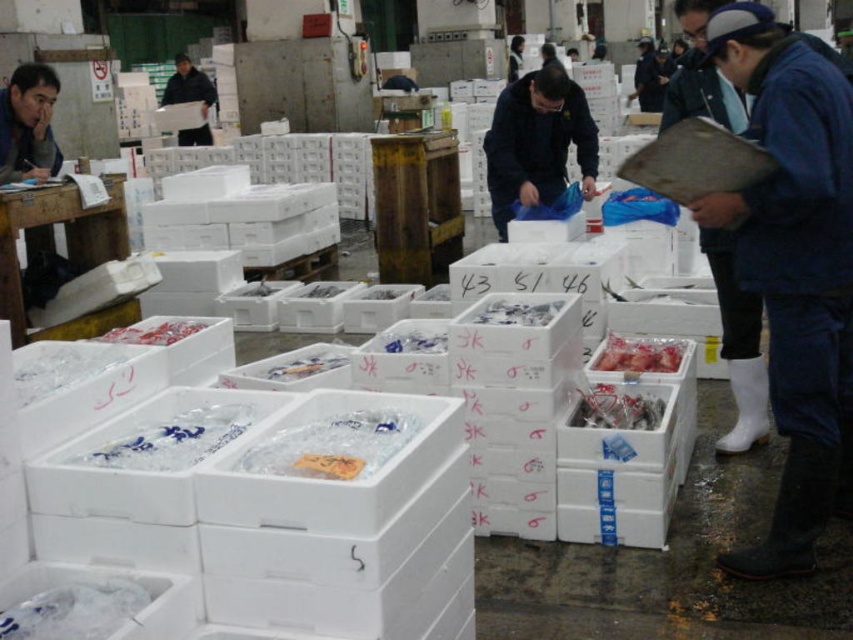
Can you confirm if blue denim jacket at upper right is positioned below black matte jacket at upper left?

Yes, blue denim jacket at upper right is below black matte jacket at upper left.

Find the location of a particular element. The height and width of the screenshot is (640, 853). blue denim jacket at upper right is located at coordinates (793, 269).

Is point (751, 554) farther from viewer compared to point (514, 148)?

That is False.

Does point (786, 525) lie in front of point (492, 214)?

Yes, point (786, 525) is closer to viewer.

The image size is (853, 640). What are the coordinates of `blue denim jacket at upper right` in the screenshot? It's located at (793, 269).

Between dark blue jacket at center and black matte jacket at upper left, which one has less height?

With less height is dark blue jacket at center.

Image resolution: width=853 pixels, height=640 pixels. I want to click on dark blue jacket at center, so click(537, 141).

Identify the location of dark blue jacket at center. This screenshot has width=853, height=640. (537, 141).

At what (x,y) coordinates should I click in order to perform the action: click on dark blue jacket at center. Please return your answer as a coordinate pair (x, y). This screenshot has height=640, width=853. Looking at the image, I should click on (537, 141).